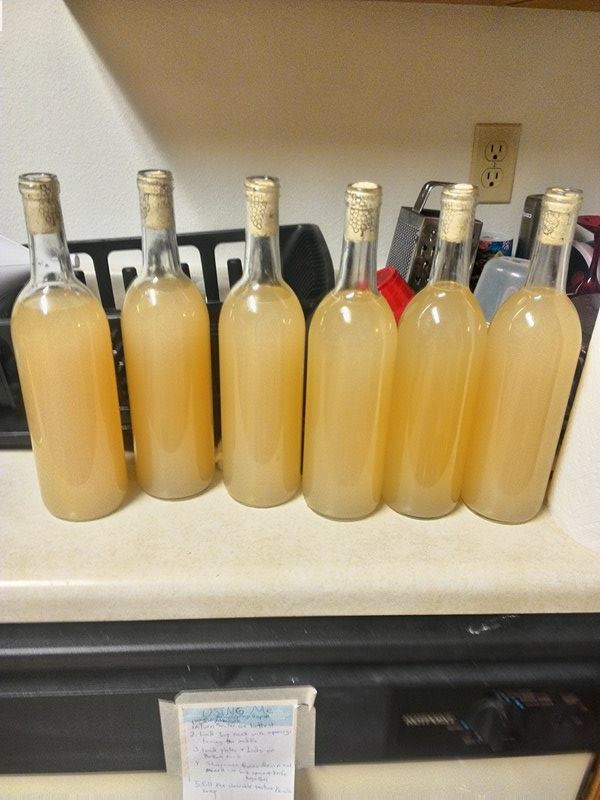
The width and height of the screenshot is (600, 800). Identify the location of metal cheese grater. (426, 248).